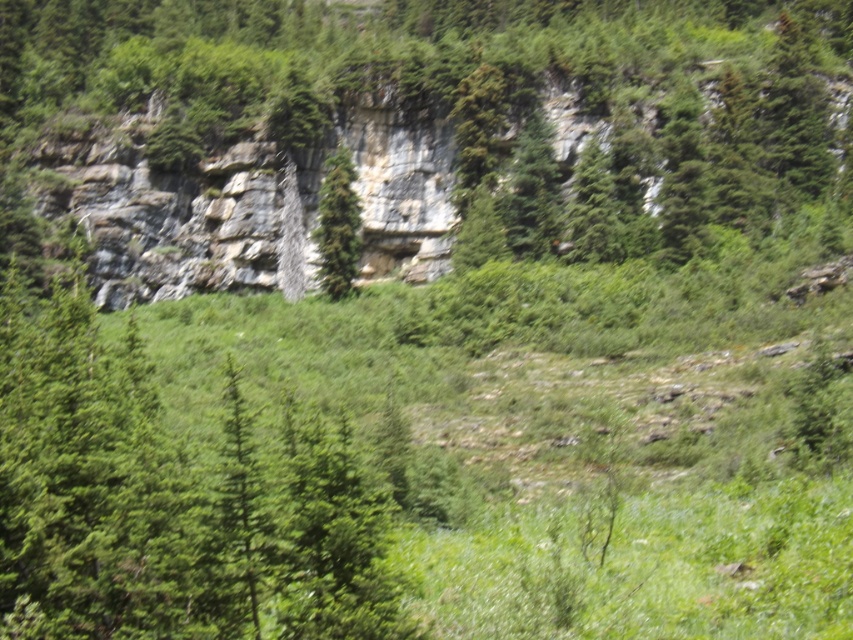
You are standing in front of the rocky cliff and notice the green leafy tree at upper center. Based on its position, can you determine if the tree is closer to the cliff or the grassy area?

The green leafy tree at upper center is located at point coordinates that place it closer to the cliff than the grassy area.

You are a hiker standing in front of the rocky cliff and want to take a photo of both the green textured tree at center and the green leafy tree at center. Which tree should you move closer to in order to capture both in the frame without zooming?

To capture both the green textured tree at center and the green leafy tree at center in the frame without zooming, you should move closer to the green leafy tree at center since it is smaller and requires less distance to include both trees in the shot.